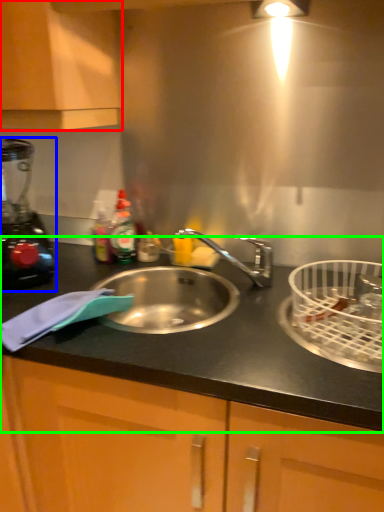
Question: Which object is the farthest from cabinetry (highlighted by a red box)? Choose among these: blender (highlighted by a blue box) or countertop (highlighted by a green box).

Choices:
 (A) blender
 (B) countertop

Answer: (B)